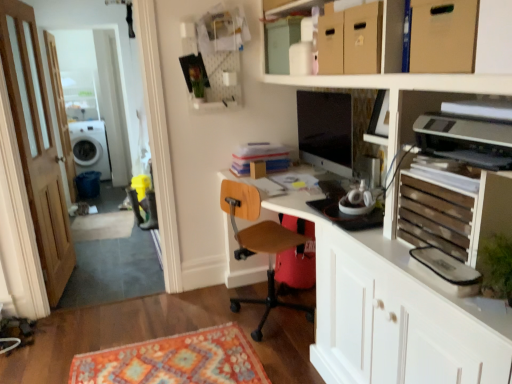
Where is `free space to the left of wooden at center`? free space to the left of wooden at center is located at coordinates (201, 305).